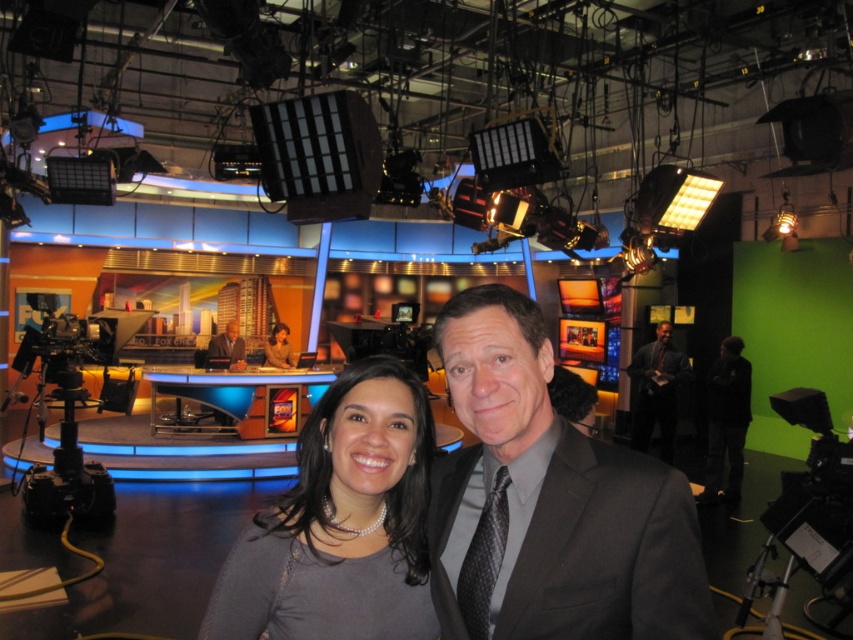
You are a costume designer who needs to place a 20 inch wide prop between the smooth gray suit at center and the matte black suit at center. Is there enough space between them to fit the prop?

The smooth gray suit at center is 22.03 inches from matte black suit at center, so yes, the 20 inch wide prop can fit between them as the distance is sufficient.

You are a camera operator in the studio. You need to focus on either the point at (740, 476) or the point at (656, 346). Which point should you choose to ensure the camera is focused on the subject closer to the front of the scene?

You should choose the point at (740, 476) because it is closer to the camera than the point at (656, 346), making it the subject in the front of the scene.

You are a camera operator in the studio. You need to focus on either the point at [233,330] or the point at [264,353]. Which point should you choose to ensure the camera focuses on the closer one?

Point at [233,330] is closer to the viewer than point at [264,353], so you should focus on point at [233,330] to ensure the camera focuses on the closer one.